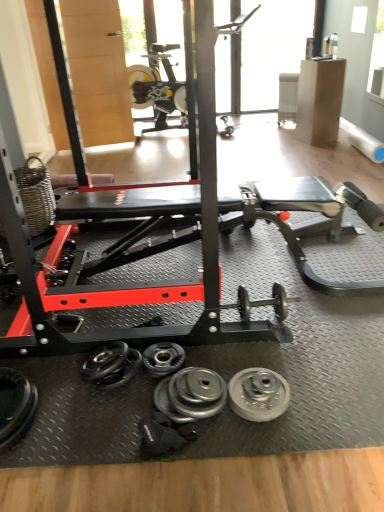
Where is `vacant space behind silver metallic weight at center, the 1th wheel in the right-to-left sequence`? vacant space behind silver metallic weight at center, the 1th wheel in the right-to-left sequence is located at coordinates (249, 358).